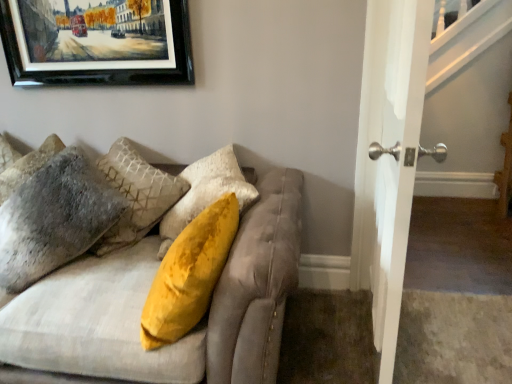
Question: Is fuzzy gray pillow at left, the 2th pillow positioned from the right, oriented towards velvet beige couch at upper left?

Choices:
 (A) no
 (B) yes

Answer: (B)

Question: Is fuzzy gray pillow at left, placed as the 1th pillow when sorted from left to right, at the left side of velvet beige couch at upper left?

Choices:
 (A) no
 (B) yes

Answer: (B)

Question: Can you confirm if fuzzy gray pillow at left, placed as the 1th pillow when sorted from left to right, is taller than velvet beige couch at upper left?

Choices:
 (A) yes
 (B) no

Answer: (B)

Question: Is fuzzy gray pillow at left, the 2th pillow positioned from the right, shorter than velvet beige couch at upper left?

Choices:
 (A) no
 (B) yes

Answer: (B)

Question: Does fuzzy gray pillow at left, the 2th pillow positioned from the right, have a lesser width compared to velvet beige couch at upper left?

Choices:
 (A) no
 (B) yes

Answer: (B)

Question: From a real-world perspective, is fuzzy gray pillow at left, placed as the 1th pillow when sorted from left to right, beneath velvet beige couch at upper left?

Choices:
 (A) yes
 (B) no

Answer: (B)

Question: From a real-world perspective, is fuzzy gray pillow at left, marked as the 2th pillow in a left-to-right arrangement, positioned over velvet beige couch at upper left based on gravity?

Choices:
 (A) yes
 (B) no

Answer: (A)

Question: Is velvet beige couch at upper left a part of fuzzy gray pillow at left, marked as the 2th pillow in a left-to-right arrangement?

Choices:
 (A) no
 (B) yes

Answer: (A)

Question: Is fuzzy gray pillow at left, marked as the 2th pillow in a left-to-right arrangement, located outside velvet beige couch at upper left?

Choices:
 (A) yes
 (B) no

Answer: (B)

Question: Is fuzzy gray pillow at left, the 1th pillow viewed from the right, in contact with velvet beige couch at upper left?

Choices:
 (A) yes
 (B) no

Answer: (B)

Question: Is fuzzy gray pillow at left, marked as the 2th pillow in a left-to-right arrangement, thinner than velvet beige couch at upper left?

Choices:
 (A) yes
 (B) no

Answer: (A)

Question: Does fuzzy gray pillow at left, the 1th pillow viewed from the right, turn towards velvet beige couch at upper left?

Choices:
 (A) no
 (B) yes

Answer: (B)

Question: Could you tell me if velvet beige couch at upper left is turned towards fuzzy gray pillow at left, the 1th pillow viewed from the right?

Choices:
 (A) yes
 (B) no

Answer: (A)